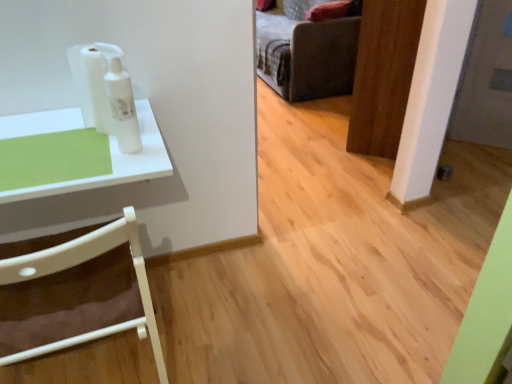
Locate an element on the screen. This screenshot has height=384, width=512. vacant area that is in front of white glossy lotion at upper left is located at coordinates (108, 170).